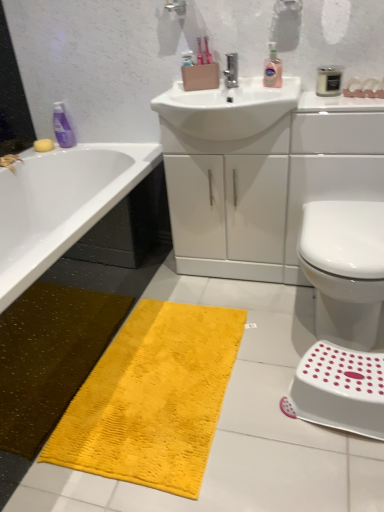
Question: Considering the relative sizes of white plastic step stool at lower right and white glossy bidet at lower right in the image provided, is white plastic step stool at lower right taller than white glossy bidet at lower right?

Choices:
 (A) no
 (B) yes

Answer: (A)

Question: Could you tell me if white plastic step stool at lower right is turned towards white glossy bidet at lower right?

Choices:
 (A) yes
 (B) no

Answer: (B)

Question: Is white plastic step stool at lower right smaller than white glossy bidet at lower right?

Choices:
 (A) yes
 (B) no

Answer: (A)

Question: Would you say white plastic step stool at lower right contains white glossy bidet at lower right?

Choices:
 (A) yes
 (B) no

Answer: (B)

Question: Is white plastic step stool at lower right directly adjacent to white glossy bidet at lower right?

Choices:
 (A) yes
 (B) no

Answer: (B)

Question: Visually, is yellow sponge at upper left positioned to the left or to the right of white glossy bidet at lower right?

Choices:
 (A) right
 (B) left

Answer: (B)

Question: Based on their sizes in the image, would you say yellow sponge at upper left is bigger or smaller than white glossy bidet at lower right?

Choices:
 (A) big
 (B) small

Answer: (B)

Question: From the image's perspective, is yellow sponge at upper left located above or below white glossy bidet at lower right?

Choices:
 (A) above
 (B) below

Answer: (A)

Question: Is point click(x=43, y=151) closer or farther from the camera than point click(x=331, y=300)?

Choices:
 (A) farther
 (B) closer

Answer: (A)

Question: Is point (324, 68) positioned closer to the camera than point (231, 54)?

Choices:
 (A) closer
 (B) farther

Answer: (A)

Question: From a real-world perspective, is white matte jar at upper right, the first mouthwash from the front, above or below polished chrome tap at center?

Choices:
 (A) below
 (B) above

Answer: (A)

Question: In the image, is white matte jar at upper right, which appears as the 1th mouthwash when viewed from the right, on the left side or the right side of polished chrome tap at center?

Choices:
 (A) right
 (B) left

Answer: (A)

Question: Looking at the image, does white matte jar at upper right, which is the 2th mouthwash from left to right, seem bigger or smaller compared to polished chrome tap at center?

Choices:
 (A) big
 (B) small

Answer: (B)

Question: Does point (324, 76) appear closer or farther from the camera than point (36, 139)?

Choices:
 (A) closer
 (B) farther

Answer: (A)

Question: Is white matte jar at upper right, marked as the 2th mouthwash in a back-to-front arrangement, wider or thinner than yellow sponge at upper left?

Choices:
 (A) thin
 (B) wide

Answer: (B)